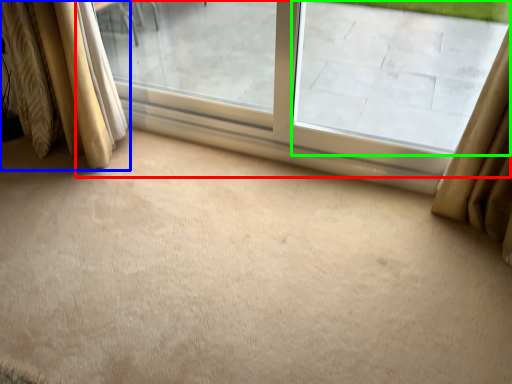
Question: Estimate the real-world distances between objects in this image. Which object is closer to window (highlighted by a red box), curtain (highlighted by a blue box) or window screen (highlighted by a green box)?

Choices:
 (A) curtain
 (B) window screen

Answer: (B)